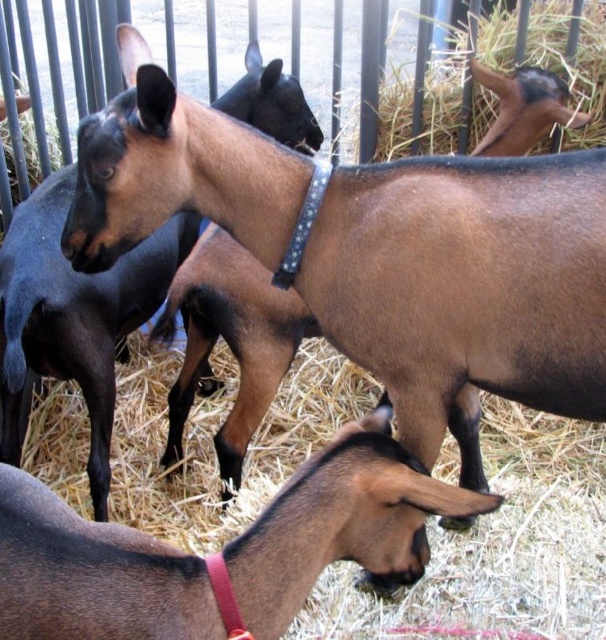
You are standing at the center of the enclosure looking towards the entrance. Which direction should you move to reach the brown matte goat at lower left?

Since the brown matte goat at lower left is located at coordinates approximately 0.861 on the x axis and 0.366 on the y axis, you should move towards the lower left direction to reach it from the center.